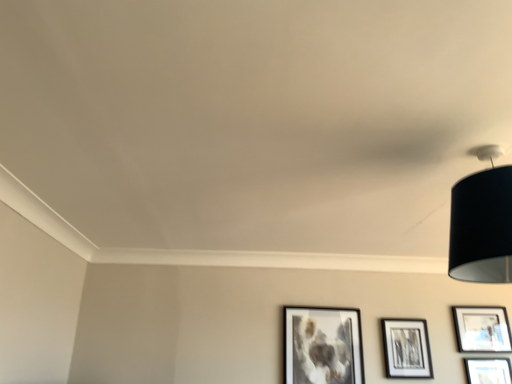
Question: Is matte black picture frame at lower right, the third picture frame viewed from the left, completely or partially outside of matte black picture frame at lower right, arranged as the fourth picture frame when viewed from the left?

Choices:
 (A) no
 (B) yes

Answer: (B)

Question: Can you confirm if matte black picture frame at lower right, the third picture frame viewed from the left, is positioned to the right of matte black picture frame at lower right, arranged as the fourth picture frame when viewed from the left?

Choices:
 (A) no
 (B) yes

Answer: (A)

Question: Can you confirm if matte black picture frame at lower right, positioned as the 2th picture frame in right-to-left order, is wider than matte black picture frame at lower right, which is the 1th picture frame in right-to-left order?

Choices:
 (A) no
 (B) yes

Answer: (A)

Question: Does matte black picture frame at lower right, positioned as the 2th picture frame in right-to-left order, appear on the left side of matte black picture frame at lower right, which is the 1th picture frame in right-to-left order?

Choices:
 (A) no
 (B) yes

Answer: (B)

Question: Does matte black picture frame at lower right, the third picture frame viewed from the left, have a lesser width compared to matte black picture frame at lower right, which is the 1th picture frame in right-to-left order?

Choices:
 (A) no
 (B) yes

Answer: (B)

Question: Is matte black picture frame at lower right, arranged as the fourth picture frame when viewed from the left, spatially inside black fabric lampshade at upper right, or outside of it?

Choices:
 (A) outside
 (B) inside

Answer: (A)

Question: In terms of height, does matte black picture frame at lower right, which is the 1th picture frame in right-to-left order, look taller or shorter compared to black fabric lampshade at upper right?

Choices:
 (A) tall
 (B) short

Answer: (B)

Question: Visually, is matte black picture frame at lower right, arranged as the fourth picture frame when viewed from the left, positioned to the left or to the right of black fabric lampshade at upper right?

Choices:
 (A) right
 (B) left

Answer: (A)

Question: From the image's perspective, relative to black fabric lampshade at upper right, is matte black picture frame at lower right, which is the 1th picture frame in right-to-left order, above or below?

Choices:
 (A) below
 (B) above

Answer: (A)

Question: Is point (313, 336) closer or farther from the camera than point (466, 178)?

Choices:
 (A) farther
 (B) closer

Answer: (A)

Question: From their relative heights in the image, would you say matte black picture frame at lower center, placed as the fourth picture frame when sorted from right to left, is taller or shorter than black fabric lampshade at upper right?

Choices:
 (A) short
 (B) tall

Answer: (B)

Question: From the image's perspective, relative to black fabric lampshade at upper right, is matte black picture frame at lower center, placed as the fourth picture frame when sorted from right to left, above or below?

Choices:
 (A) below
 (B) above

Answer: (A)

Question: From a real-world perspective, is matte black picture frame at lower center, placed as the fourth picture frame when sorted from right to left, positioned above or below black fabric lampshade at upper right?

Choices:
 (A) above
 (B) below

Answer: (B)

Question: Looking at the image, does matte black picture frame at lower right, positioned as the 2th picture frame in right-to-left order, seem bigger or smaller compared to matte black picture frame at lower center, which is counted as the 1th picture frame, starting from the left?

Choices:
 (A) small
 (B) big

Answer: (A)

Question: From their relative heights in the image, would you say matte black picture frame at lower right, positioned as the 2th picture frame in right-to-left order, is taller or shorter than matte black picture frame at lower center, which is counted as the 1th picture frame, starting from the left?

Choices:
 (A) tall
 (B) short

Answer: (B)